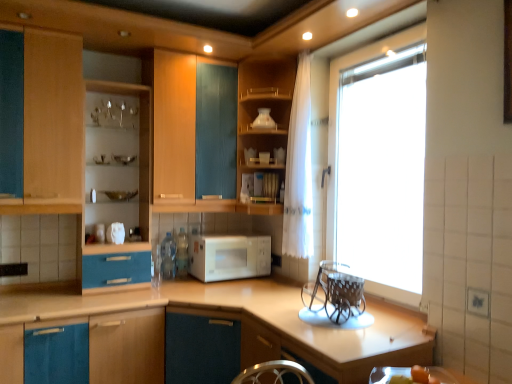
Measure the distance between white matte microwave at center and camera.

2.78 meters.

How much space does wooden cabinet at upper center, which appears as the 1th cabinetry when viewed from the right, occupy horizontally?

It is 15.87 inches.

Locate an element on the screen. This screenshot has height=384, width=512. white sheer curtain at right is located at coordinates (298, 169).

At what (x,y) coordinates should I click in order to perform the action: click on white matte microwave at center. Please return your answer as a coordinate pair (x, y). Image resolution: width=512 pixels, height=384 pixels. Looking at the image, I should click on pos(229,256).

Could you measure the distance between matte wood shelves at center, acting as the second cabinetry starting from the left, and clear glass basket at right, the 2th appliance in the left-to-right sequence?

matte wood shelves at center, acting as the second cabinetry starting from the left, is 4.35 feet away from clear glass basket at right, the 2th appliance in the left-to-right sequence.

Does matte wood shelves at center, acting as the second cabinetry starting from the left, have a smaller size compared to clear glass basket at right, positioned as the second appliance in back-to-front order?

No.

Which is more to the left, matte wood shelves at center, which ranks as the second cabinetry in right-to-left order, or clear glass basket at right, arranged as the 1th appliance when viewed from the right?

Positioned to the left is matte wood shelves at center, which ranks as the second cabinetry in right-to-left order.

Is point (148, 213) less distant than point (318, 309)?

No, it is not.

Could you tell me if transparent glass window at upper right is facing white sheer curtain at right?

No, transparent glass window at upper right does not turn towards white sheer curtain at right.

Which is in front, point (369, 55) or point (303, 189)?

Point (369, 55)

Find the location of a particular element. The height and width of the screenshot is (384, 512). window that is in front of the white sheer curtain at right is located at coordinates (336, 117).

From a real-world perspective, who is located higher, transparent glass window at upper right or white sheer curtain at right?

In real-world perspective, white sheer curtain at right is above.

Considering the relative positions of transparent glass window at upper right and clear glass basket at right, which is counted as the 1th appliance, starting from the bottom, in the image provided, is transparent glass window at upper right to the left or to the right of clear glass basket at right, which is counted as the 1th appliance, starting from the bottom,?

In the image, transparent glass window at upper right appears on the right side of clear glass basket at right, which is counted as the 1th appliance, starting from the bottom.

Looking at their sizes, would you say transparent glass window at upper right is wider or thinner than clear glass basket at right, marked as the second appliance in a top-to-bottom arrangement?

Clearly, transparent glass window at upper right has less width compared to clear glass basket at right, marked as the second appliance in a top-to-bottom arrangement.

Does transparent glass window at upper right contain clear glass basket at right, arranged as the 1th appliance when viewed from the right?

No, clear glass basket at right, arranged as the 1th appliance when viewed from the right, is located outside of transparent glass window at upper right.

Considering the positions of objects clear glass basket at right, positioned as the second appliance in back-to-front order, and matte wood shelves at center, acting as the second cabinetry starting from the left, in the image provided, who is behind, clear glass basket at right, positioned as the second appliance in back-to-front order, or matte wood shelves at center, acting as the second cabinetry starting from the left,?

matte wood shelves at center, acting as the second cabinetry starting from the left, is further away from the camera.

From the image's perspective, does clear glass basket at right, marked as the second appliance in a top-to-bottom arrangement, appear higher than matte wood shelves at center, which ranks as the second cabinetry in right-to-left order?

No, from the image's perspective, clear glass basket at right, marked as the second appliance in a top-to-bottom arrangement, is not over matte wood shelves at center, which ranks as the second cabinetry in right-to-left order.

Is clear glass basket at right, positioned as the second appliance in back-to-front order, positioned with its back to matte wood shelves at center, which ranks as the second cabinetry in right-to-left order?

No, clear glass basket at right, positioned as the second appliance in back-to-front order, is not facing away from matte wood shelves at center, which ranks as the second cabinetry in right-to-left order.

Considering the sizes of objects white sheer curtain at right and transparent glass window at upper right in the image provided, who is shorter, white sheer curtain at right or transparent glass window at upper right?

With less height is white sheer curtain at right.

Is point (294, 187) positioned behind point (328, 199)?

That is False.

Identify the location of window in front of the white sheer curtain at right. (336, 117).

From a real-world perspective, is white sheer curtain at right positioned above or below transparent glass window at upper right?

From a real-world perspective, white sheer curtain at right is physically above transparent glass window at upper right.

Is transparent glass window at upper right inside the boundaries of white glossy vase at upper center, the 2th appliance in the bottom-to-top sequence, or outside?

transparent glass window at upper right lies outside white glossy vase at upper center, the 2th appliance in the bottom-to-top sequence.

From a real-world perspective, is transparent glass window at upper right under white glossy vase at upper center, which is counted as the 1th appliance, starting from the back?

Yes, from a real-world perspective, transparent glass window at upper right is under white glossy vase at upper center, which is counted as the 1th appliance, starting from the back.

In order to click on appliance above the transparent glass window at upper right (from the image's perspective) in this screenshot , I will do `click(264, 120)`.

Is point (287, 125) closer or farther from the camera than point (351, 328)?

Point (287, 125) is farther from the camera than point (351, 328).

Is wooden cabinet at upper center, which appears as the 1th cabinetry when viewed from the right, facing away from clear glass basket at right, arranged as the 1th appliance when viewed from the right?

No.

What's the angular difference between wooden cabinet at upper center, which appears as the 1th cabinetry when viewed from the right, and clear glass basket at right, marked as the second appliance in a top-to-bottom arrangement,'s facing directions?

The facing directions of wooden cabinet at upper center, which appears as the 1th cabinetry when viewed from the right, and clear glass basket at right, marked as the second appliance in a top-to-bottom arrangement, are 94.4 degrees apart.

Locate an element on the screen. This screenshot has width=512, height=384. cabinetry that is the 1st object above the clear glass basket at right, the 2th appliance in the left-to-right sequence (from a real-world perspective) is located at coordinates (139, 142).

Identify the location of window on the right of white sheer curtain at right. The image size is (512, 384). (336, 117).

Considering their positions, is transparent glass window at upper right positioned closer to white glossy vase at upper center, which is counted as the 1th appliance, starting from the back, than wooden cabinet at upper center, marked as the third cabinetry in a left-to-right arrangement?

wooden cabinet at upper center, marked as the third cabinetry in a left-to-right arrangement, is positioned closer to the anchor white glossy vase at upper center, which is counted as the 1th appliance, starting from the back.

From the image, which object appears to be nearer to transparent glass window at upper right, clear glass basket at right, placed as the first appliance when sorted from front to back, or wooden cabinet at upper center, marked as the third cabinetry in a left-to-right arrangement?

Based on the image, wooden cabinet at upper center, marked as the third cabinetry in a left-to-right arrangement, appears to be nearer to transparent glass window at upper right.

Which object lies further to the anchor point wooden cabinet at upper center, which appears as the 1th cabinetry when viewed from the right, clear glass basket at right, marked as the second appliance in a top-to-bottom arrangement, or white glossy vase at upper center, which is counted as the 1th appliance, starting from the back?

Based on the image, clear glass basket at right, marked as the second appliance in a top-to-bottom arrangement, appears to be further to wooden cabinet at upper center, which appears as the 1th cabinetry when viewed from the right.

Based on their spatial positions, is clear glass basket at right, the 2th appliance in the left-to-right sequence, or white glossy vase at upper center, which appears as the 2th appliance when viewed from the front, further from transparent glass window at upper right?

Among the two, clear glass basket at right, the 2th appliance in the left-to-right sequence, is located further to transparent glass window at upper right.

Based on their spatial positions, is matte wood shelves at center, which ranks as the second cabinetry in right-to-left order, or blue matte cabinet at lower left, the first cabinetry viewed from the left, closer to transparent glass window at upper right?

matte wood shelves at center, which ranks as the second cabinetry in right-to-left order, lies closer to transparent glass window at upper right than the other object.

Considering their positions, is wooden cabinet at upper center, which appears as the 1th cabinetry when viewed from the right, positioned closer to white matte microwave at center than blue matte cabinet at lower left, the first cabinetry viewed from the left?

wooden cabinet at upper center, which appears as the 1th cabinetry when viewed from the right, is closer to white matte microwave at center.

Based on their spatial positions, is white glossy vase at upper center, acting as the 1th appliance starting from the top, or clear glass basket at right, marked as the second appliance in a top-to-bottom arrangement, closer to transparent glass window at upper right?

Among the two, white glossy vase at upper center, acting as the 1th appliance starting from the top, is located nearer to transparent glass window at upper right.

Considering their positions, is clear glass basket at right, the 2th appliance in the left-to-right sequence, positioned further to transparent glass window at upper right than blue matte cabinet at lower left, the first cabinetry viewed from the left?

Based on the image, blue matte cabinet at lower left, the first cabinetry viewed from the left, appears to be further to transparent glass window at upper right.

Locate an element on the screen. microwave oven between blue matte cabinet at lower left, the first cabinetry viewed from the left, and white sheer curtain at right from left to right is located at coordinates (229, 256).

You are a GUI agent. You are given a task and a screenshot of the screen. Output one action in this format:
    pyautogui.click(x=<x>, y=<y>)
    Task: Click on the microwave oven between matte wood shelves at center, acting as the second cabinetry starting from the left, and wooden cabinet at upper center, which appears as the 1th cabinetry when viewed from the right, from left to right
    
    Given the screenshot: What is the action you would take?
    pyautogui.click(x=229, y=256)

Locate an element on the screen. microwave oven between white glossy vase at upper center, the 2th appliance in the bottom-to-top sequence, and clear glass basket at right, the 2th appliance in the left-to-right sequence, from top to bottom is located at coordinates (229, 256).

Image resolution: width=512 pixels, height=384 pixels. In order to click on window between white glossy vase at upper center, which appears as the 2th appliance when viewed from the front, and white matte microwave at center from top to bottom in this screenshot , I will do `click(336, 117)`.